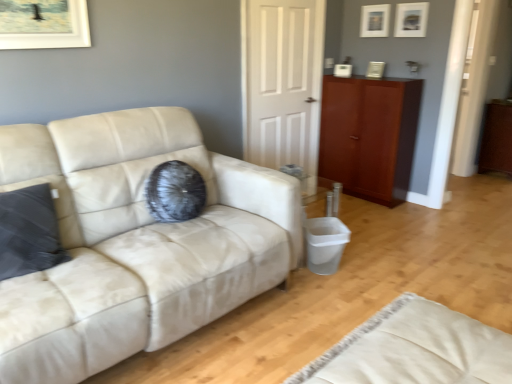
Question: Is mahogany wood cabinet at right smaller than beige fabric rug at lower right?

Choices:
 (A) no
 (B) yes

Answer: (A)

Question: Considering the relative sizes of mahogany wood cabinet at right and beige fabric rug at lower right in the image provided, is mahogany wood cabinet at right wider than beige fabric rug at lower right?

Choices:
 (A) no
 (B) yes

Answer: (A)

Question: Is mahogany wood cabinet at right closer to camera compared to beige fabric rug at lower right?

Choices:
 (A) no
 (B) yes

Answer: (A)

Question: Is mahogany wood cabinet at right placed right next to beige fabric rug at lower right?

Choices:
 (A) yes
 (B) no

Answer: (B)

Question: Does mahogany wood cabinet at right have a greater height compared to beige fabric rug at lower right?

Choices:
 (A) yes
 (B) no

Answer: (A)

Question: Considering the relative positions of mahogany wood cabinet at right and beige fabric rug at lower right in the image provided, is mahogany wood cabinet at right to the right of beige fabric rug at lower right from the viewer's perspective?

Choices:
 (A) no
 (B) yes

Answer: (B)

Question: Considering the relative sizes of brown wood dresser at right and matte white picture frame at upper right, which is counted as the first picture frame, starting from the back, in the image provided, is brown wood dresser at right bigger than matte white picture frame at upper right, which is counted as the first picture frame, starting from the back,?

Choices:
 (A) no
 (B) yes

Answer: (B)

Question: Considering the relative sizes of brown wood dresser at right and matte white picture frame at upper right, which is counted as the first picture frame, starting from the back, in the image provided, is brown wood dresser at right smaller than matte white picture frame at upper right, which is counted as the first picture frame, starting from the back,?

Choices:
 (A) yes
 (B) no

Answer: (B)

Question: Can you confirm if brown wood dresser at right is positioned to the left of matte white picture frame at upper right, the 1th picture frame viewed from the left?

Choices:
 (A) yes
 (B) no

Answer: (B)

Question: Is brown wood dresser at right looking in the opposite direction of matte white picture frame at upper right, which is counted as the first picture frame, starting from the back?

Choices:
 (A) no
 (B) yes

Answer: (A)

Question: Considering the relative sizes of brown wood dresser at right and matte white picture frame at upper right, arranged as the second picture frame when viewed from the right, in the image provided, is brown wood dresser at right thinner than matte white picture frame at upper right, arranged as the second picture frame when viewed from the right,?

Choices:
 (A) yes
 (B) no

Answer: (B)

Question: Is brown wood dresser at right positioned in front of matte white picture frame at upper right, arranged as the second picture frame when viewed from the right?

Choices:
 (A) yes
 (B) no

Answer: (B)

Question: Is white matte door at center oriented towards matte white picture frame at upper center, the second picture frame in the back-to-front sequence?

Choices:
 (A) no
 (B) yes

Answer: (A)